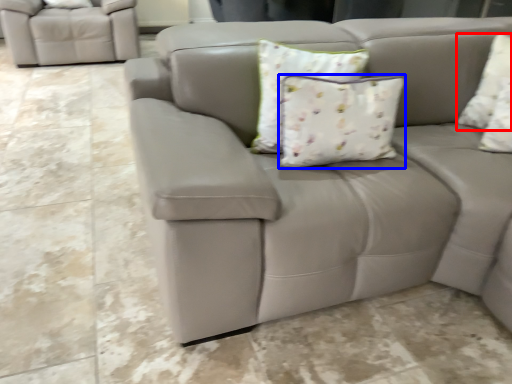
Question: Which of the following is the farthest to the observer, pillow (highlighted by a red box) or pillow (highlighted by a blue box)?

Choices:
 (A) pillow
 (B) pillow

Answer: (A)